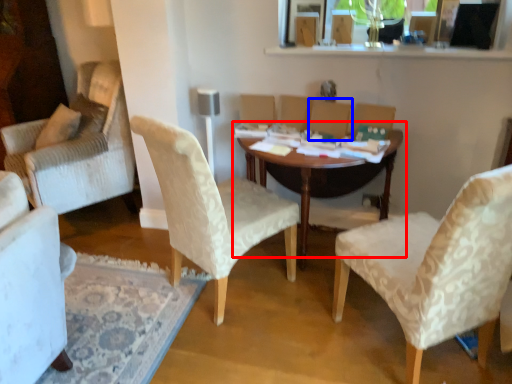
Question: Which point is closer to the camera, table (highlighted by a red box) or armchair (highlighted by a blue box)?

Choices:
 (A) table
 (B) armchair

Answer: (A)